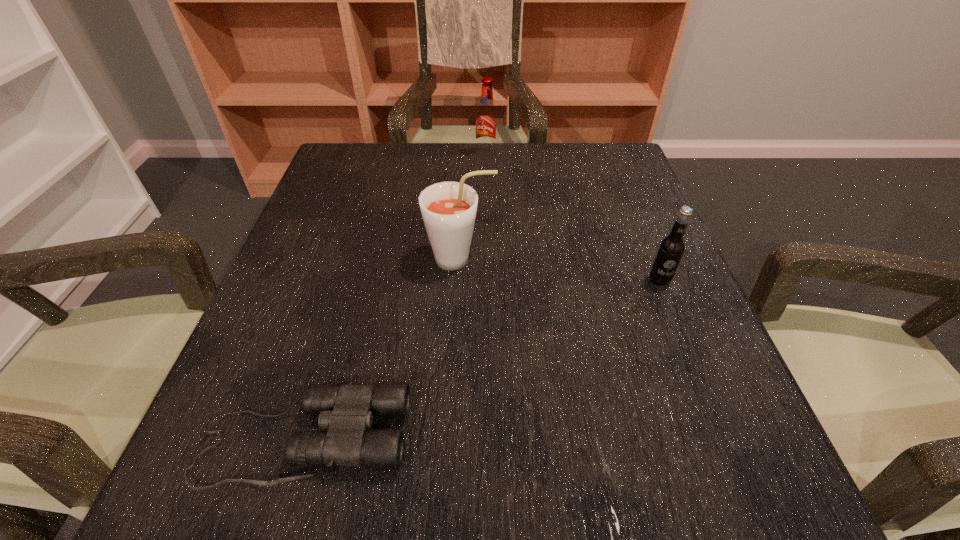
At what (x,y) coordinates should I click in order to perform the action: click on object at the right edge. Please return your answer as a coordinate pair (x, y). Looking at the image, I should click on (671, 248).

Identify the location of object that is positioned at the near left corner. (347, 411).

Locate an element on the screen. vacant space at the far edge of the desktop is located at coordinates (458, 171).

Where is `vacant space at the near edge`? This screenshot has width=960, height=540. vacant space at the near edge is located at coordinates [477, 465].

At what (x,y) coordinates should I click in order to perform the action: click on free space at the left edge. Please return your answer as a coordinate pair (x, y). This screenshot has width=960, height=540. Looking at the image, I should click on (366, 245).

This screenshot has height=540, width=960. In the image, there is a desktop. In order to click on vacant space at the right edge in this screenshot , I will do `click(622, 246)`.

The height and width of the screenshot is (540, 960). In the image, there is a desktop. Find the location of `blank space at the far left corner`. blank space at the far left corner is located at coordinates (382, 148).

In the image, there is a desktop. Where is `vacant space at the far right corner`? The image size is (960, 540). vacant space at the far right corner is located at coordinates (583, 175).

This screenshot has width=960, height=540. I want to click on free space between the farthest root beer and the rightmost object, so click(572, 218).

This screenshot has height=540, width=960. I want to click on free space between the shortest object and the farthest root beer, so click(x=395, y=297).